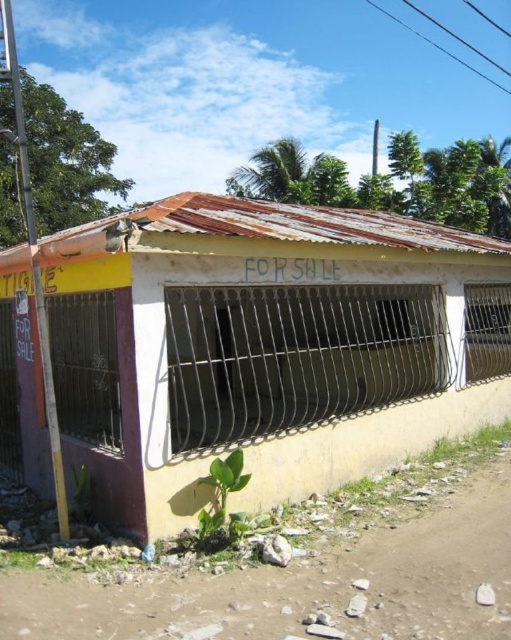
Is the position of yellow matte building at center less distant than that of brown dirt track at lower left?

No, it is not.

The height and width of the screenshot is (640, 511). Describe the element at coordinates (267, 344) in the screenshot. I see `yellow matte building at center` at that location.

This screenshot has width=511, height=640. What do you see at coordinates (267, 344) in the screenshot?
I see `yellow matte building at center` at bounding box center [267, 344].

Where is `yellow matte building at center`? yellow matte building at center is located at coordinates (267, 344).